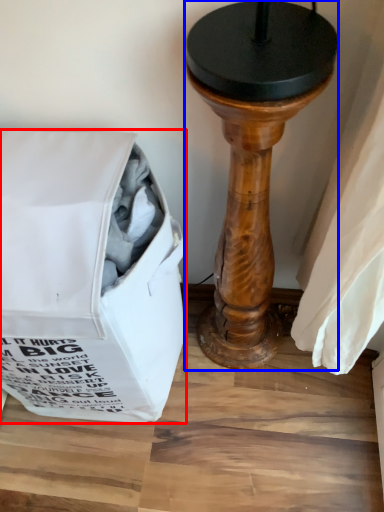
Question: Which object appears farthest to the camera in this image, bag (highlighted by a red box) or furniture (highlighted by a blue box)?

Choices:
 (A) bag
 (B) furniture

Answer: (A)